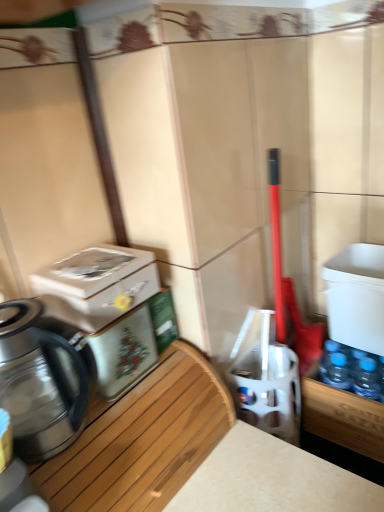
Question: Does metallic silver water cooler at left, the 1th water cooler from the left, turn towards woodenmaterial/texture at left?

Choices:
 (A) yes
 (B) no

Answer: (B)

Question: Can you confirm if metallic silver water cooler at left, the 3th water cooler from the right, is positioned to the left of woodenmaterial/texture at left?

Choices:
 (A) no
 (B) yes

Answer: (B)

Question: Does metallic silver water cooler at left, the 1th water cooler from the left, have a greater width compared to woodenmaterial/texture at left?

Choices:
 (A) no
 (B) yes

Answer: (A)

Question: Is metallic silver water cooler at left, the 3th water cooler from the right, far away from woodenmaterial/texture at left?

Choices:
 (A) yes
 (B) no

Answer: (B)

Question: Is metallic silver water cooler at left, the 3th water cooler from the right, surrounding woodenmaterial/texture at left?

Choices:
 (A) no
 (B) yes

Answer: (A)

Question: Is metallic silver water cooler at left, the 3th water cooler from the right, facing away from woodenmaterial/texture at left?

Choices:
 (A) yes
 (B) no

Answer: (B)

Question: Can you confirm if woodenmaterial/texture at left is thinner than white glossy water cooler at center, which is the 2th water cooler from right to left?

Choices:
 (A) yes
 (B) no

Answer: (B)

Question: Can you confirm if woodenmaterial/texture at left is shorter than white glossy water cooler at center, which is the 2th water cooler from right to left?

Choices:
 (A) no
 (B) yes

Answer: (B)

Question: From a real-world perspective, is woodenmaterial/texture at left below white glossy water cooler at center, placed as the 2th water cooler when sorted from left to right?

Choices:
 (A) no
 (B) yes

Answer: (A)

Question: Can you confirm if woodenmaterial/texture at left is taller than white glossy water cooler at center, placed as the 2th water cooler when sorted from left to right?

Choices:
 (A) yes
 (B) no

Answer: (B)

Question: Is woodenmaterial/texture at left facing towards white glossy water cooler at center, which is the 2th water cooler from right to left?

Choices:
 (A) no
 (B) yes

Answer: (A)

Question: Is woodenmaterial/texture at left at the left side of white glossy water cooler at center, which is the 2th water cooler from right to left?

Choices:
 (A) yes
 (B) no

Answer: (A)

Question: From a real-world perspective, is woodenmaterial/texture at left beneath shiny metallic kettle at left?

Choices:
 (A) yes
 (B) no

Answer: (A)